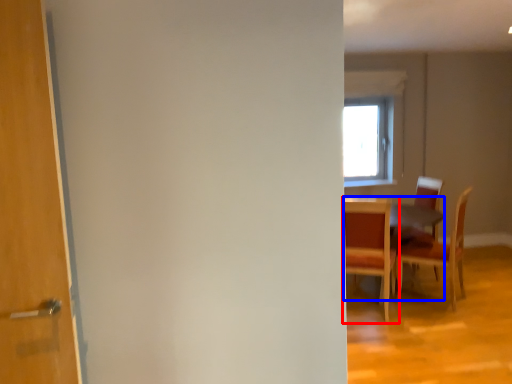
Question: Among these objects, which one is farthest to the camera, chair (highlighted by a red box) or table (highlighted by a blue box)?

Choices:
 (A) chair
 (B) table

Answer: (B)